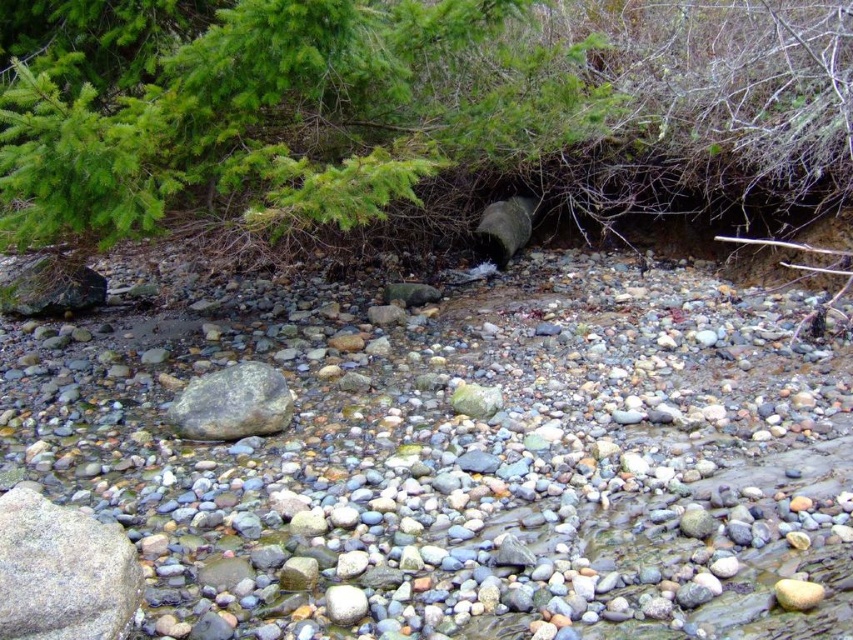
Question: Among these objects, which one is nearest to the camera?

Choices:
 (A) green matte tree at upper center
 (B) smooth gray rock at center

Answer: (B)

Question: Which point is closer to the camera taking this photo?

Choices:
 (A) pos(376,44)
 (B) pos(691,276)
 (C) pos(236,417)

Answer: (A)

Question: Does smooth gray rock at center lie behind gray smooth rock at center?

Choices:
 (A) yes
 (B) no

Answer: (B)

Question: Does smooth gray rock at center have a smaller size compared to green matte tree at upper center?

Choices:
 (A) no
 (B) yes

Answer: (A)

Question: Which of the following is the farthest from the observer?

Choices:
 (A) (418, 611)
 (B) (482, 20)

Answer: (B)

Question: Does smooth gray rock at center appear on the right side of green matte tree at upper center?

Choices:
 (A) no
 (B) yes

Answer: (A)